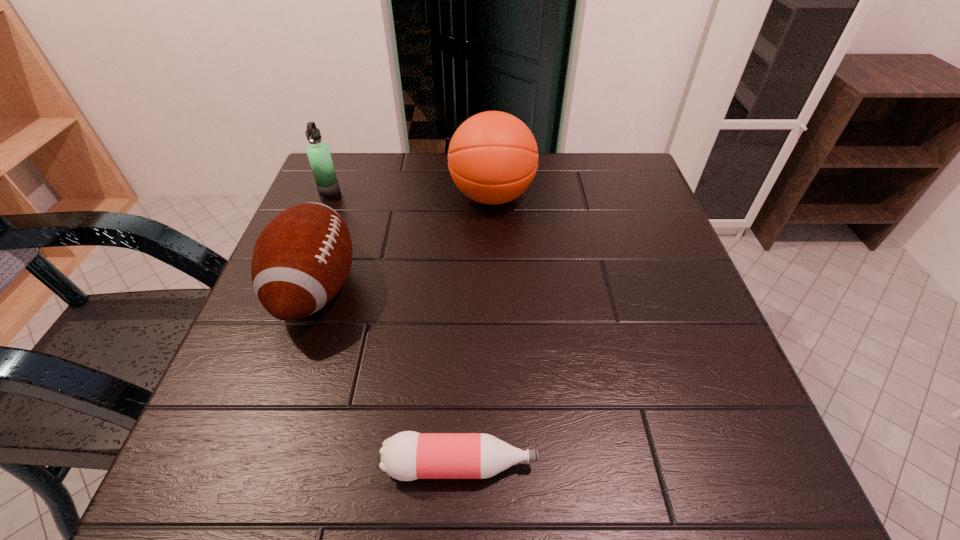
Image resolution: width=960 pixels, height=540 pixels. Identify the location of basketball. (493, 157).

Identify the location of thermos bottle. The width and height of the screenshot is (960, 540). (318, 152).

At what (x,y) coordinates should I click in order to perform the action: click on the second nearest object. Please return your answer as a coordinate pair (x, y). Image resolution: width=960 pixels, height=540 pixels. Looking at the image, I should click on (301, 259).

Identify the location of the nearest object. (406, 456).

Locate an element on the screen. The height and width of the screenshot is (540, 960). the shortest object is located at coordinates (406, 456).

At what (x,y) coordinates should I click in order to perform the action: click on free region located 0.060m on the front of the basketball. Please return your answer as a coordinate pair (x, y). Looking at the image, I should click on (493, 240).

Where is `vacant space located on the right of the thermos bottle`? The image size is (960, 540). vacant space located on the right of the thermos bottle is located at coordinates (421, 194).

Find the location of a particular element. The height and width of the screenshot is (540, 960). vacant region located on the laces of the football is located at coordinates (505, 288).

Find the location of a particular element. free space located with the cap open on the nearest object is located at coordinates (753, 465).

You are a GUI agent. You are given a task and a screenshot of the screen. Output one action in this format:
    pyautogui.click(x=<x>, y=<y>)
    Task: Click on the basketball that is at the far edge
    The height and width of the screenshot is (540, 960).
    Given the screenshot: What is the action you would take?
    pyautogui.click(x=493, y=157)